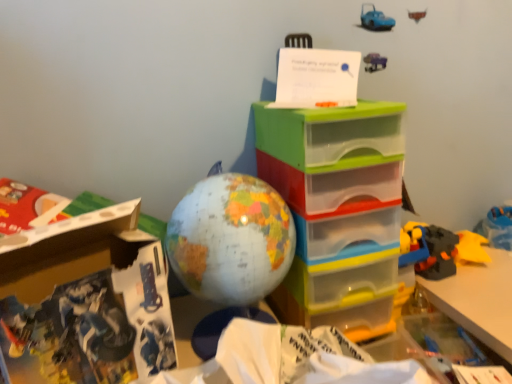
Question: Considering the positions of translucent plastic drawers at center and white cardboard box at lower left in the image, is translucent plastic drawers at center bigger or smaller than white cardboard box at lower left?

Choices:
 (A) big
 (B) small

Answer: (A)

Question: In terms of height, does translucent plastic drawers at center look taller or shorter compared to white cardboard box at lower left?

Choices:
 (A) short
 (B) tall

Answer: (B)

Question: Based on their relative distances, which object is nearer to the translucent plastic drawers at center?

Choices:
 (A) map-patterned globe at center
 (B) white cardboard box at lower left

Answer: (A)

Question: Estimate the real-world distances between objects in this image. Which object is farther from the map-patterned globe at center?

Choices:
 (A) translucent plastic drawers at center
 (B) white cardboard box at lower left

Answer: (B)